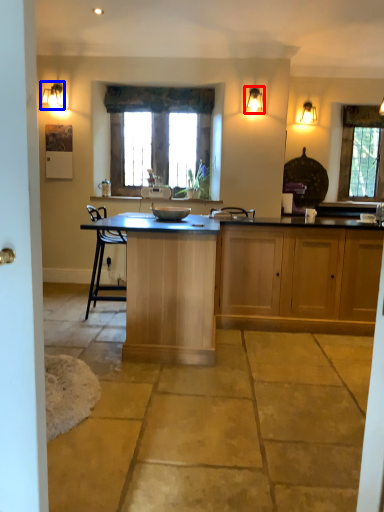
Question: Which point is further to the camera, light fixture (highlighted by a red box) or light fixture (highlighted by a blue box)?

Choices:
 (A) light fixture
 (B) light fixture

Answer: (B)